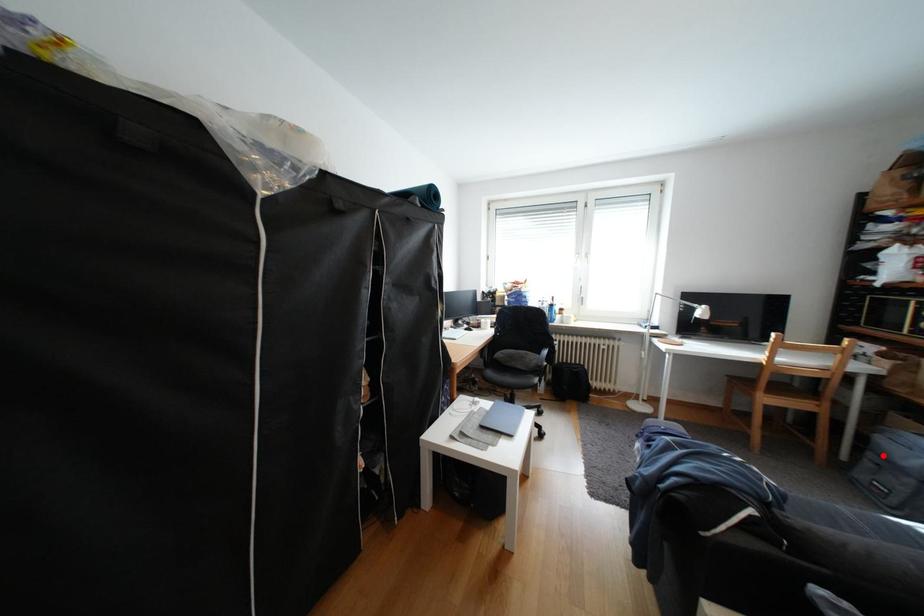
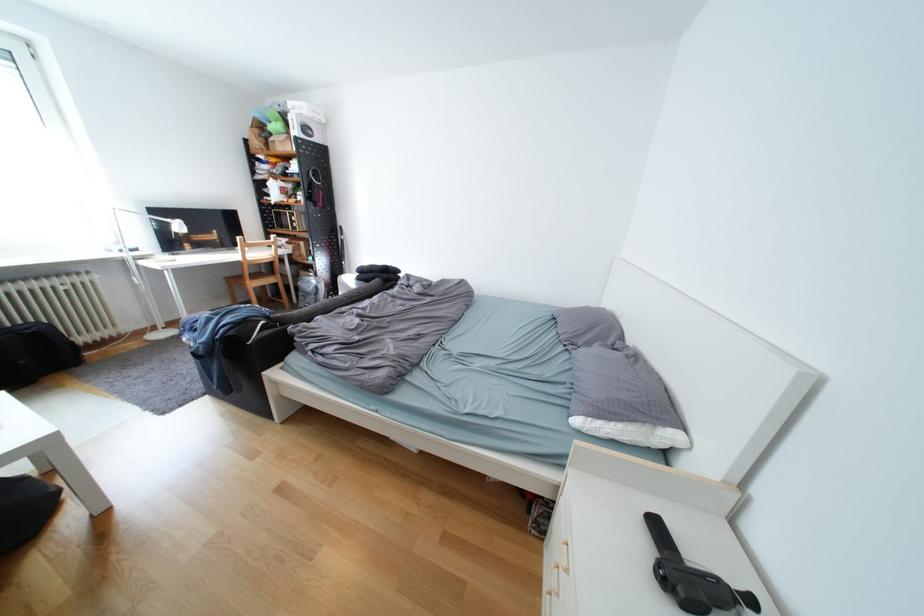
In the second image, find the point that corresponds to the highlighted location in the first image.

(313, 294)